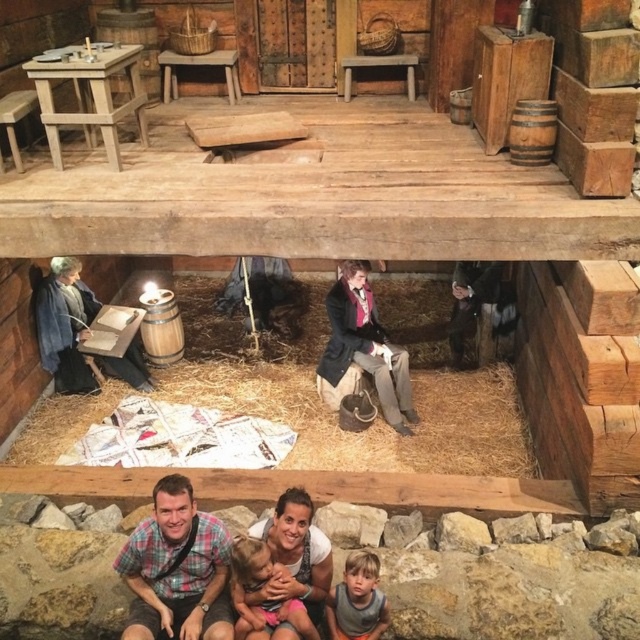
Does point (387, 400) lie behind point (353, 576)?

Yes.

Does smooth brown coat at center have a greater width compared to light brown hair at lower center?

Correct, the width of smooth brown coat at center exceeds that of light brown hair at lower center.

Is point (332, 358) positioned behind point (369, 556)?

Yes, point (332, 358) is farther from viewer.

In order to click on smooth brown coat at center in this screenshot , I will do `click(364, 346)`.

Between smooth brown coat at center and soft pink fabric at lower center, which one appears on the left side from the viewer's perspective?

From the viewer's perspective, soft pink fabric at lower center appears more on the left side.

Is smooth brown coat at center shorter than soft pink fabric at lower center?

Incorrect, smooth brown coat at center's height does not fall short of soft pink fabric at lower center's.

Between point (381, 410) and point (269, 560), which one is positioned behind?

The point (381, 410) is behind.

The width and height of the screenshot is (640, 640). Identify the location of smooth brown coat at center. (364, 346).

Is point (241, 568) farther from camera compared to point (326, 614)?

No, it is not.

In the scene shown: Between soft pink fabric at lower center and light brown hair at lower center, which one is positioned lower?

light brown hair at lower center

Does point (236, 544) lie in front of point (376, 605)?

Yes, point (236, 544) is closer to viewer.

Identify the location of soft pink fabric at lower center. (259, 588).